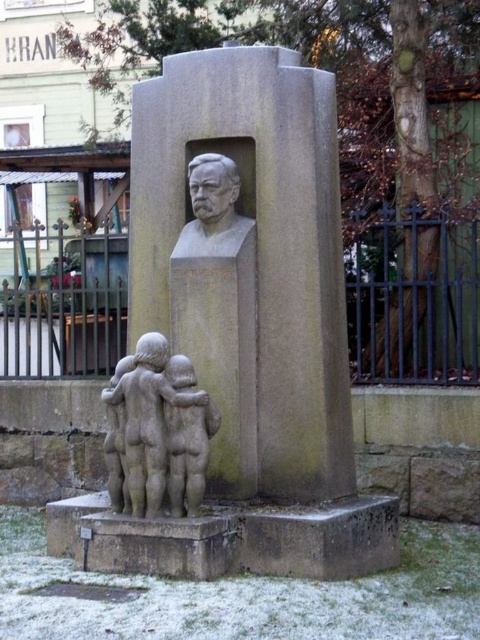
Is gray stone monument at center in front of gray stone children at lower left?

Yes, gray stone monument at center is in front of gray stone children at lower left.

You are a GUI agent. You are given a task and a screenshot of the screen. Output one action in this format:
    pyautogui.click(x=<x>, y=<y>)
    Task: Click on the gray stone monument at center
    
    Given the screenshot: What is the action you would take?
    pyautogui.click(x=245, y=332)

Is gray stone monument at center taller than matte gray bust at center?

Yes, gray stone monument at center is taller than matte gray bust at center.

Which is more to the right, gray stone monument at center or matte gray bust at center?

Positioned to the right is gray stone monument at center.

Between point (323, 291) and point (210, 188), which one is positioned in front?

Point (323, 291) is more forward.

What are the coordinates of `gray stone monument at center` in the screenshot? It's located at click(245, 332).

Is gray stone children at lower left positioned in front of matte gray bust at center?

Yes, gray stone children at lower left is closer to the viewer.

Is point (183, 401) positioned in front of point (229, 161)?

That is True.

The width and height of the screenshot is (480, 640). What are the coordinates of `gray stone children at lower left` in the screenshot? It's located at (159, 428).